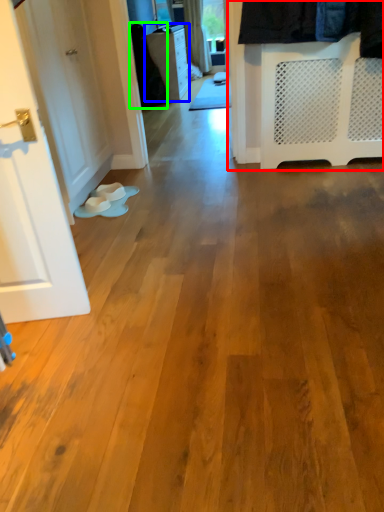
Question: Based on their relative distances, which object is farther from closet (highlighted by a red box)? Choose from furniture (highlighted by a blue box) and clothing (highlighted by a green box).

Choices:
 (A) furniture
 (B) clothing

Answer: (A)